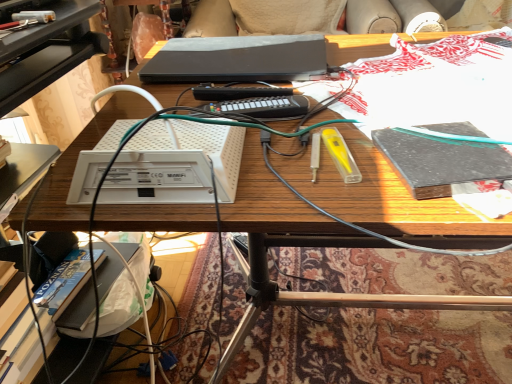
I want to click on free space to the right of white plastic router at center, so click(302, 162).